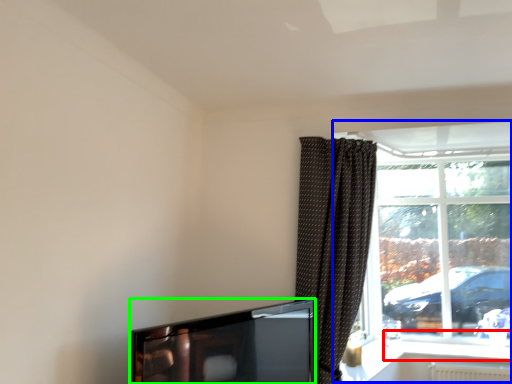
Question: Considering the real-world distances, which object is closest to window sill (highlighted by a red box)? window (highlighted by a blue box) or television (highlighted by a green box).

Choices:
 (A) window
 (B) television

Answer: (A)